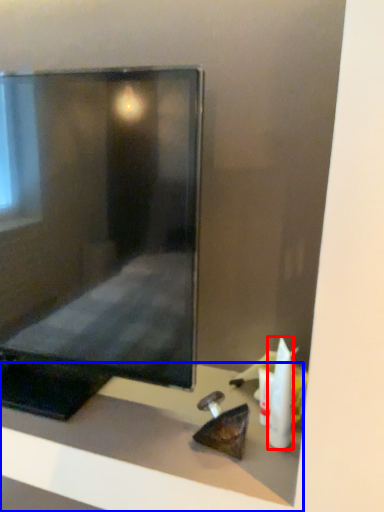
Question: Among these objects, which one is farthest to the camera, toiletry (highlighted by a red box) or furniture (highlighted by a blue box)?

Choices:
 (A) toiletry
 (B) furniture

Answer: (A)